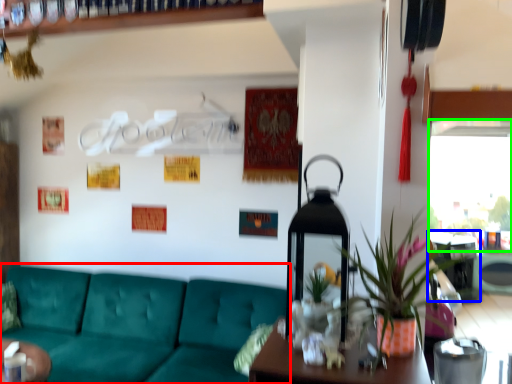
Question: Which is nearer to the studio couch (highlighted by a red box)? table (highlighted by a blue box) or window screen (highlighted by a green box).

Choices:
 (A) table
 (B) window screen

Answer: (A)